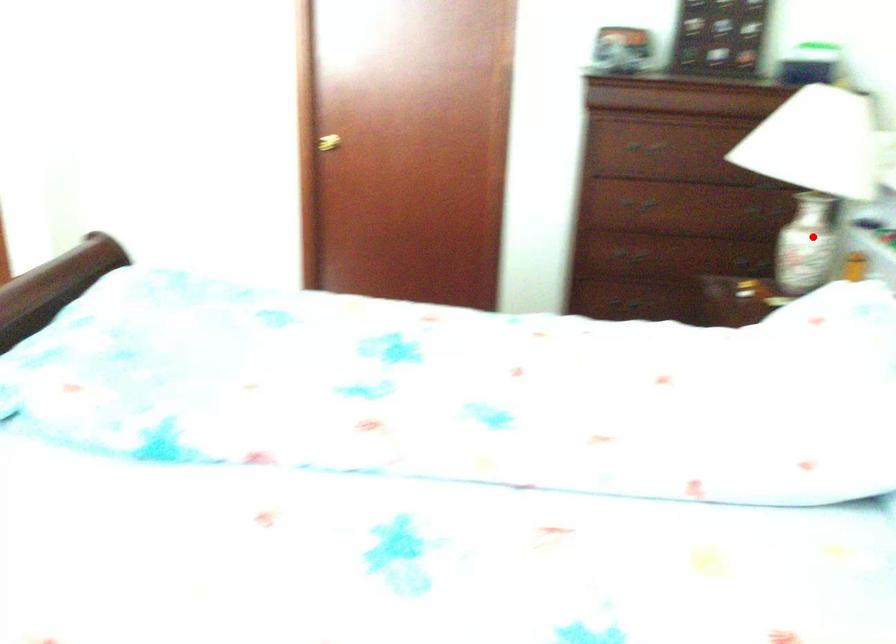
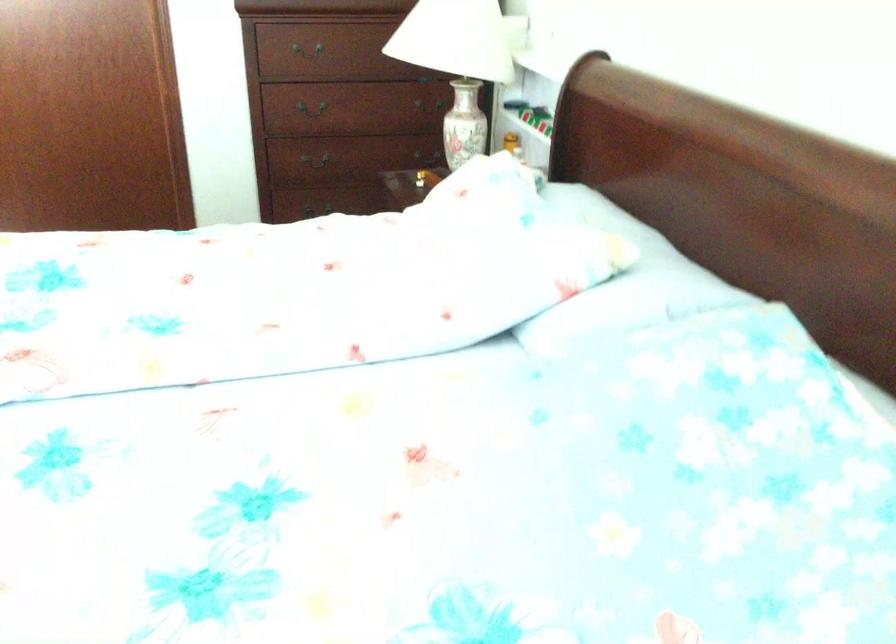
Locate, in the second image, the point that corresponds to the highlighted location in the first image.

(463, 124)